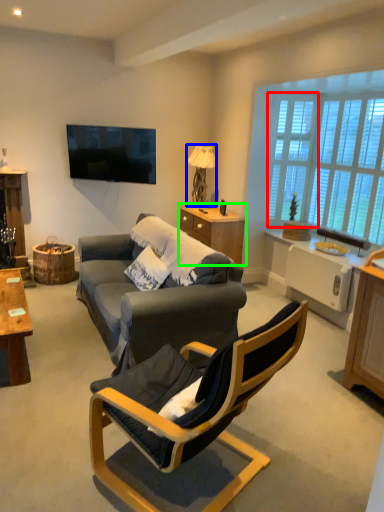
Question: Which is nearer to the window screen (highlighted by a red box)? lamp (highlighted by a blue box) or dresser (highlighted by a green box).

Choices:
 (A) lamp
 (B) dresser

Answer: (B)